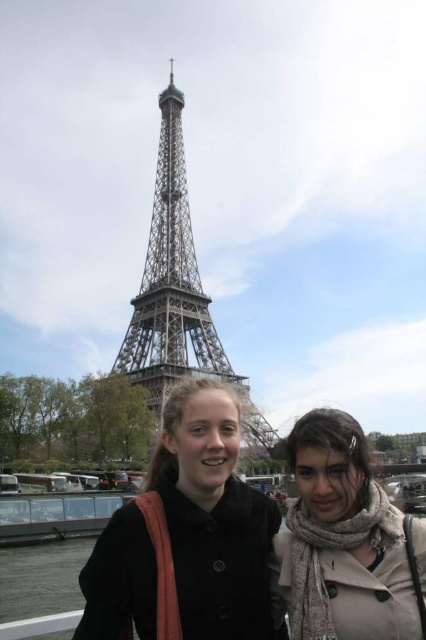
Which is more to the left, black matte coat at center or metallic gray tower at center?

Positioned to the left is metallic gray tower at center.

Where is `black matte coat at center`? This screenshot has height=640, width=426. black matte coat at center is located at coordinates (256, 540).

Does black matte coat at center lie behind beige textured scarf at lower right?

No, black matte coat at center is in front of beige textured scarf at lower right.

Can you confirm if black matte coat at center is wider than beige textured scarf at lower right?

Indeed, black matte coat at center has a greater width compared to beige textured scarf at lower right.

Is point (367, 449) farther from camera compared to point (402, 577)?

Yes, point (367, 449) is behind point (402, 577).

The width and height of the screenshot is (426, 640). I want to click on black matte coat at center, so click(x=256, y=540).

Which is more to the left, beige textured scarf at lower right or metallic gray tower at center?

metallic gray tower at center

Which is in front, point (345, 525) or point (175, 211)?

Point (345, 525)

Between point (379, 500) and point (164, 330), which one is positioned behind?

The point (164, 330) is more distant.

Image resolution: width=426 pixels, height=640 pixels. In order to click on beige textured scarf at lower right in this screenshot , I will do `click(342, 540)`.